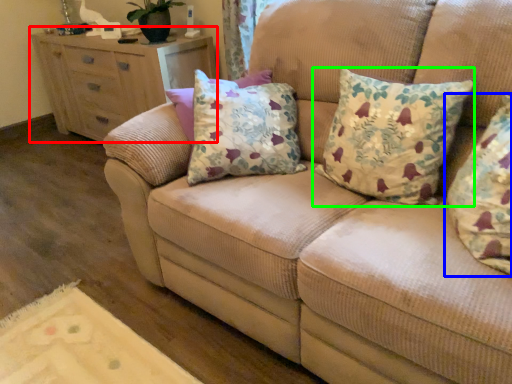
Question: Which object is positioned farthest from chest of drawers (highlighted by a red box)? Select from pillow (highlighted by a blue box) and pillow (highlighted by a green box).

Choices:
 (A) pillow
 (B) pillow

Answer: (A)